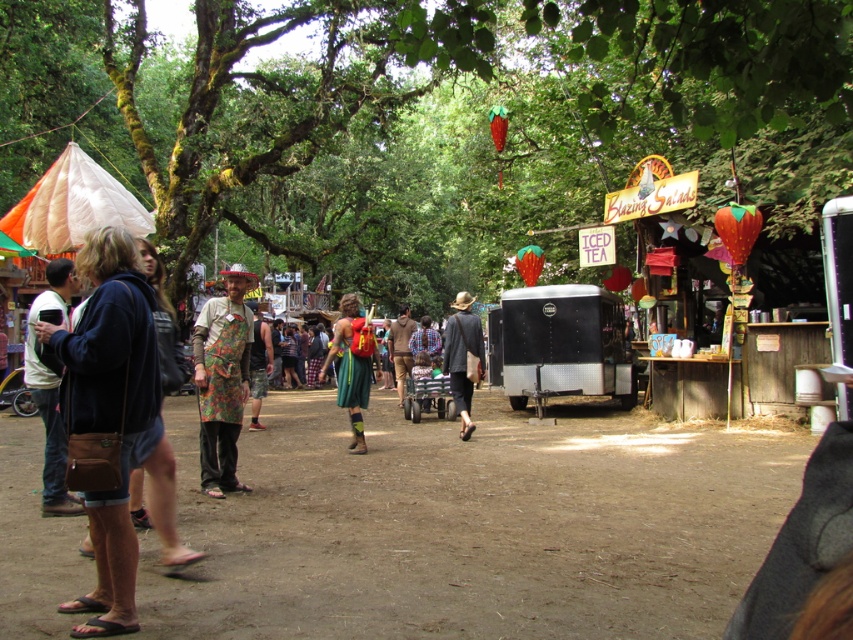
Question: Is black metal trailer at center to the right of matte brown hat at center from the viewer's perspective?

Choices:
 (A) yes
 (B) no

Answer: (A)

Question: Observing the image, what is the correct spatial positioning of green fabric skirt at center in reference to brown fabric shirt at center?

Choices:
 (A) below
 (B) above

Answer: (A)

Question: Which object is closer to the camera taking this photo?

Choices:
 (A) black metal trailer at center
 (B) floral fabric apron at center

Answer: (B)

Question: Which point is closer to the camera?

Choices:
 (A) (454, 388)
 (B) (251, 426)

Answer: (A)

Question: Does green fabric skirt at center have a smaller size compared to printed fabric shorts at center?

Choices:
 (A) yes
 (B) no

Answer: (A)

Question: Which object is closer to the camera taking this photo?

Choices:
 (A) printed fabric shorts at center
 (B) green leafy tree at center

Answer: (B)